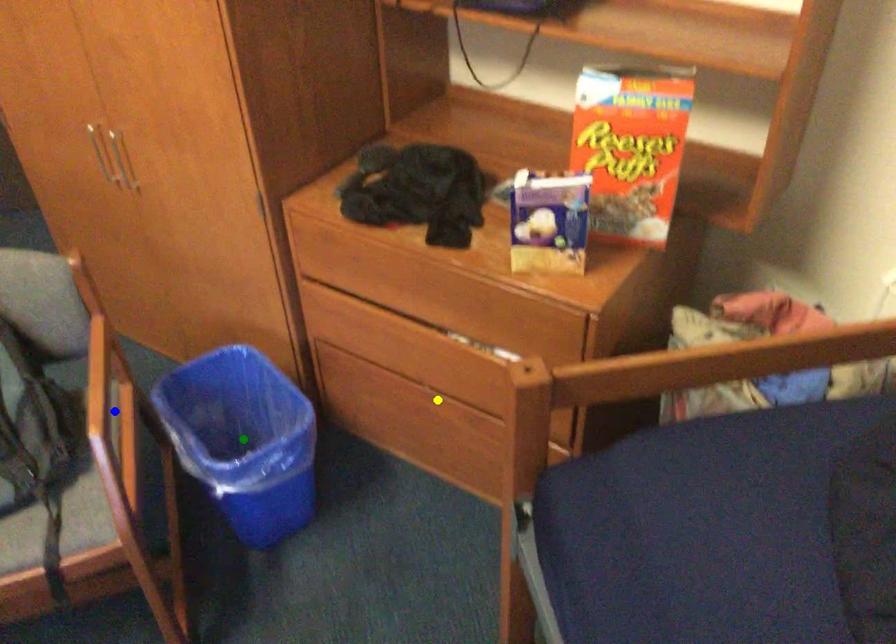
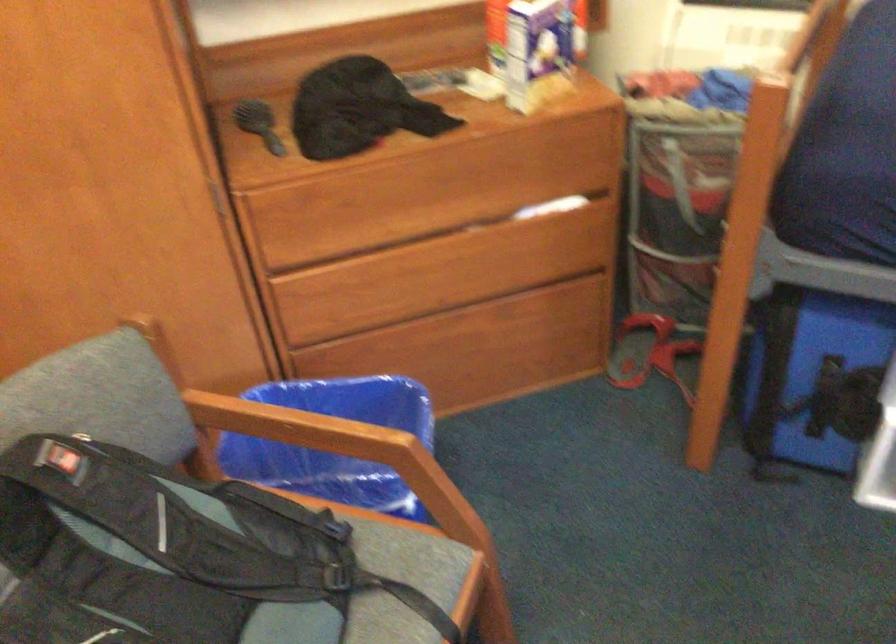
I am providing you with two images of the same scene from different viewpoints. Three points are marked in image1. Which point corresponds to a part or object that is occluded in image2?In image1, three points are marked. Which of them correspond to a part or object that is occluded in image2?Among the three points shown in image1, which one corresponds to a part or object that is no longer visible due to occlusion in image2?

Invisible in image2: green point.